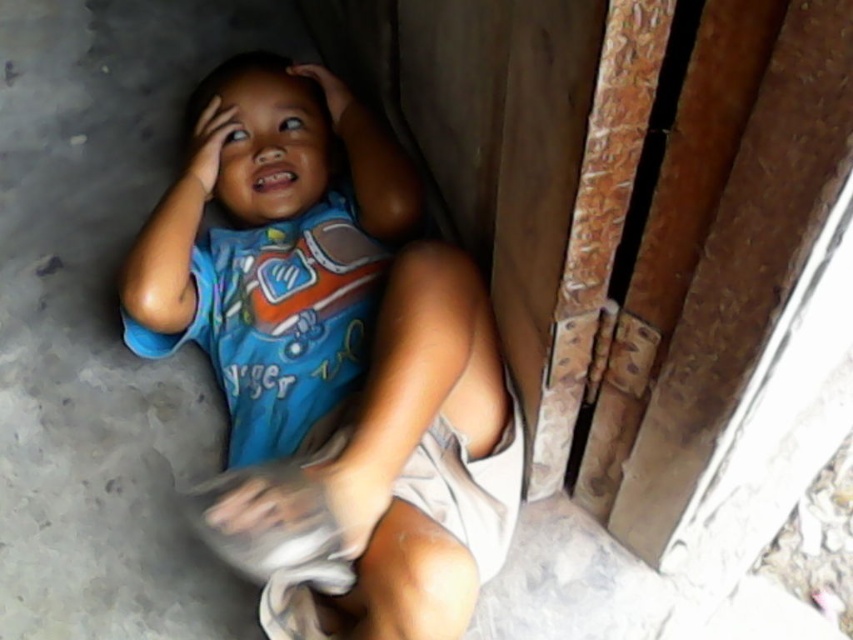
Question: Which of the following is the farthest from the observer?

Choices:
 (A) (332, 404)
 (B) (231, 180)

Answer: (B)

Question: Which object is closer to the camera taking this photo?

Choices:
 (A) blue cotton shirt at center
 (B) blue fabric head at upper center

Answer: (A)

Question: Can you confirm if blue cotton shirt at center is bigger than blue fabric head at upper center?

Choices:
 (A) yes
 (B) no

Answer: (A)

Question: Can you confirm if blue cotton shirt at center is smaller than blue fabric head at upper center?

Choices:
 (A) no
 (B) yes

Answer: (A)

Question: Can you confirm if blue cotton shirt at center is positioned above blue fabric head at upper center?

Choices:
 (A) no
 (B) yes

Answer: (A)